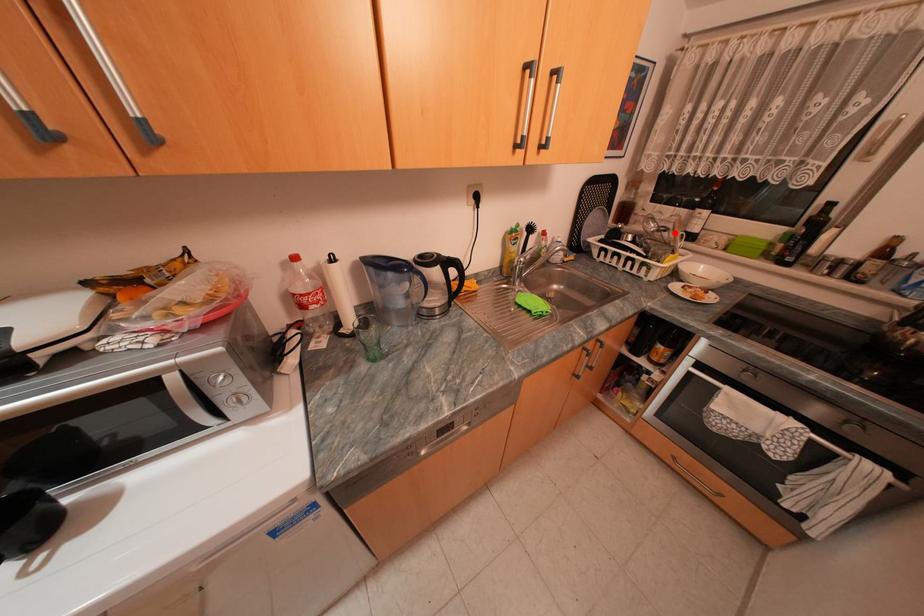
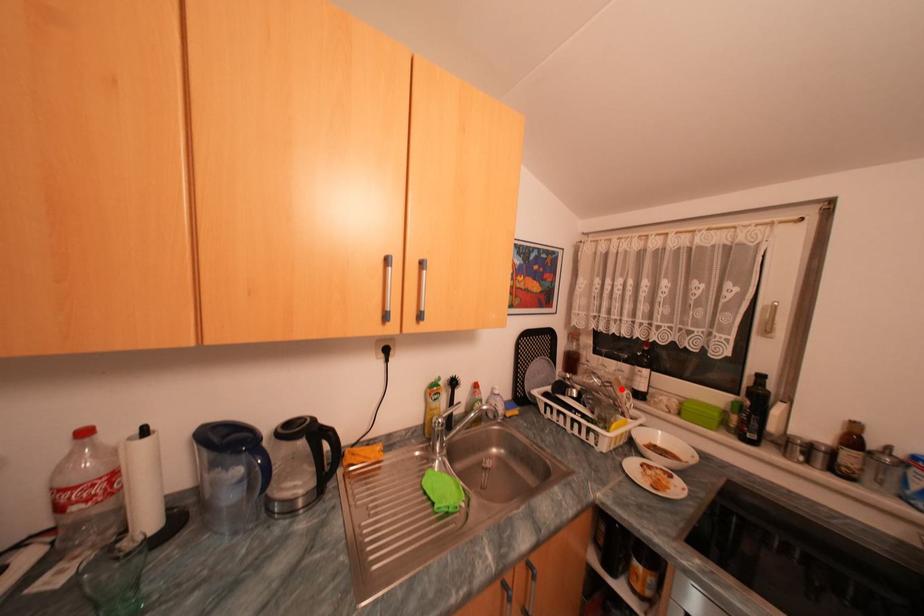
I am providing you with two images of the same scene from different viewpoints. A red point is marked on the first image and another point is marked on the second image. Are the points marked in image1 and image2 representing the same 3D position?

Yes